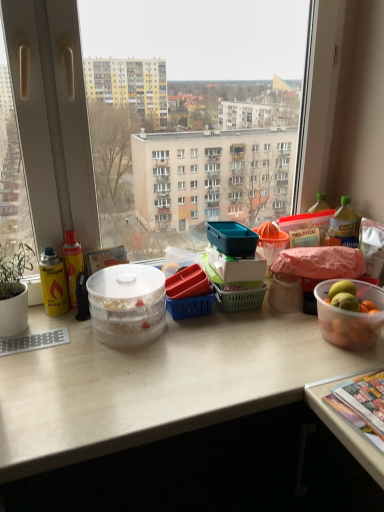
The height and width of the screenshot is (512, 384). What do you see at coordinates (178, 420) in the screenshot? I see `white matte desk at center` at bounding box center [178, 420].

Where is `transparent plastic bowl at center, marked as the first bowl in a left-to-right arrangement`? transparent plastic bowl at center, marked as the first bowl in a left-to-right arrangement is located at coordinates (127, 304).

What do you see at coordinates (127, 304) in the screenshot?
I see `transparent plastic bowl at center, marked as the first bowl in a left-to-right arrangement` at bounding box center [127, 304].

In order to face translucent plastic bowl at right, acting as the 2th bowl starting from the left, should I rotate leftwards or rightwards?

Turn right approximately 20.396 degrees to face it.

Find the location of a particular element. The width and height of the screenshot is (384, 512). translucent plastic bowl at right, acting as the 2th bowl starting from the left is located at coordinates (350, 318).

The image size is (384, 512). Identify the location of transparent glass window at center. (52, 122).

Does point (354, 225) appear closer or farther from the camera than point (126, 300)?

Point (354, 225) is farther from the camera than point (126, 300).

From the image's perspective, which is above, clear plastic bottle at right or transparent plastic bowl at center, the second bowl from the right?

clear plastic bottle at right, from the image's perspective.

Considering the relative sizes of clear plastic bottle at right and transparent plastic bowl at center, marked as the first bowl in a left-to-right arrangement, in the image provided, is clear plastic bottle at right smaller than transparent plastic bowl at center, marked as the first bowl in a left-to-right arrangement,?

Yes.

Is transparent plastic bowl at center, the second bowl from the right, thinner than translucent plastic bowl at right, acting as the 2th bowl starting from the left?

In fact, transparent plastic bowl at center, the second bowl from the right, might be wider than translucent plastic bowl at right, acting as the 2th bowl starting from the left.

Looking at this image, is transparent plastic bowl at center, marked as the first bowl in a left-to-right arrangement, looking in the opposite direction of translucent plastic bowl at right, acting as the 2th bowl starting from the left?

That's not correct — transparent plastic bowl at center, marked as the first bowl in a left-to-right arrangement, is not looking away from translucent plastic bowl at right, acting as the 2th bowl starting from the left.

Is the position of transparent plastic bowl at center, marked as the first bowl in a left-to-right arrangement, less distant than that of translucent plastic bowl at right, acting as the 2th bowl starting from the left?

No, it is not.

Is point (378, 380) positioned in front of point (105, 306)?

Yes, point (378, 380) is closer to viewer.

Which object is positioned more to the right, multicolored glossy magazine at lower right or transparent plastic bowl at center, the second bowl from the right?

multicolored glossy magazine at lower right.

Between multicolored glossy magazine at lower right and transparent plastic bowl at center, the second bowl from the right, which one has more height?

transparent plastic bowl at center, the second bowl from the right.

From a real-world perspective, which is physically below, white matte desk at center or translucent plastic bowl at right, which appears as the first bowl when viewed from the right?

white matte desk at center is physically lower.

Is point (150, 461) closer or farther from the camera than point (340, 339)?

Clearly, point (150, 461) is closer to the camera than point (340, 339).

In order to click on desk that appears on the left of translucent plastic bowl at right, acting as the 2th bowl starting from the left in this screenshot , I will do (178, 420).

Is white matte desk at center to the left of translucent plastic bowl at right, which appears as the first bowl when viewed from the right, from the viewer's perspective?

Yes.

Is point (382, 438) closer or farther from the camera than point (353, 236)?

Point (382, 438) appears to be closer to the viewer than point (353, 236).

Can clear plastic bottle at right be found inside multicolored glossy magazine at lower right?

No, clear plastic bottle at right is not surrounded by multicolored glossy magazine at lower right.

Based on their sizes in the image, would you say multicolored glossy magazine at lower right is bigger or smaller than clear plastic bottle at right?

In the image, multicolored glossy magazine at lower right appears to be larger than clear plastic bottle at right.

Based on the photo, between clear plastic bottle at right and multicolored glossy magazine at lower right, which one has less height?

Standing shorter between the two is multicolored glossy magazine at lower right.

Is point (356, 241) closer to camera compared to point (339, 397)?

No, it is behind (339, 397).

Looking at this image, from the image's perspective, would you say clear plastic bottle at right is positioned over multicolored glossy magazine at lower right?

Indeed, from the image's perspective, clear plastic bottle at right is shown above multicolored glossy magazine at lower right.

Is clear plastic bottle at right turned away from multicolored glossy magazine at lower right?

No.

From the image's perspective, does clear plastic bottle at right appear higher than white matte desk at center?

Yes, from the image's perspective, clear plastic bottle at right is on top of white matte desk at center.

Does clear plastic bottle at right turn towards white matte desk at center?

No.

Which of these two, clear plastic bottle at right or white matte desk at center, stands shorter?

clear plastic bottle at right.

The width and height of the screenshot is (384, 512). What are the coordinates of `bottle positioned vertically above the transparent plastic bowl at center, marked as the first bowl in a left-to-right arrangement (from a real-world perspective)` in the screenshot? It's located at (342, 226).

Find the location of a particular element. bowl above the transparent plastic bowl at center, marked as the first bowl in a left-to-right arrangement (from the image's perspective) is located at coordinates (350, 318).

When comparing their distances from white matte desk at center, does clear plastic bottle at right or translucent plastic bowl at right, which appears as the first bowl when viewed from the right, seem further?

Among the two, clear plastic bottle at right is located further to white matte desk at center.

Looking at the image, which one is located closer to transparent plastic bowl at center, marked as the first bowl in a left-to-right arrangement, translucent plastic bowl at right, acting as the 2th bowl starting from the left, or white matte desk at center?

white matte desk at center is positioned closer to the anchor transparent plastic bowl at center, marked as the first bowl in a left-to-right arrangement.

From the image, which object appears to be nearer to transparent glass window at center, multicolored glossy magazine at lower right or clear plastic bottle at right?

The object closer to transparent glass window at center is clear plastic bottle at right.

Based on the photo, which object lies further to the anchor point translucent plastic bowl at right, which appears as the first bowl when viewed from the right, white matte desk at center or clear plastic bottle at right?

white matte desk at center.

Which object lies further to the anchor point white matte desk at center, transparent glass window at center or clear plastic bottle at right?

The object further to white matte desk at center is clear plastic bottle at right.

Based on their spatial positions, is multicolored glossy magazine at lower right or translucent plastic bowl at right, which appears as the first bowl when viewed from the right, further from transparent glass window at center?

multicolored glossy magazine at lower right is positioned further to the anchor transparent glass window at center.

Estimate the real-world distances between objects in this image. Which object is closer to clear plastic bottle at right, translucent plastic bowl at right, acting as the 2th bowl starting from the left, or white matte desk at center?

translucent plastic bowl at right, acting as the 2th bowl starting from the left.

Based on their spatial positions, is clear plastic bottle at right or transparent glass window at center further from white matte desk at center?

clear plastic bottle at right is positioned further to the anchor white matte desk at center.

At what (x,y) coordinates should I click in order to perform the action: click on bowl between transparent plastic bowl at center, marked as the first bowl in a left-to-right arrangement, and multicolored glossy magazine at lower right. Please return your answer as a coordinate pair (x, y). This screenshot has width=384, height=512. Looking at the image, I should click on (350, 318).

In order to click on magazine between transparent plastic bowl at center, the second bowl from the right, and clear plastic bottle at right in this screenshot , I will do `click(357, 411)`.

Where is `desk situated between transparent plastic bowl at center, the second bowl from the right, and translucent plastic bowl at right, which appears as the first bowl when viewed from the right, from left to right`? The height and width of the screenshot is (512, 384). desk situated between transparent plastic bowl at center, the second bowl from the right, and translucent plastic bowl at right, which appears as the first bowl when viewed from the right, from left to right is located at coordinates (178, 420).

Locate an element on the screen. bottle between transparent glass window at center and white matte desk at center from top to bottom is located at coordinates (342, 226).